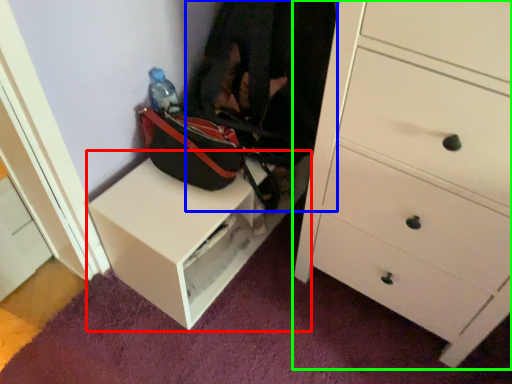
Question: Estimate the real-world distances between objects in this image. Which object is farther from table (highlighted by a red box), clothing (highlighted by a blue box) or chest of drawers (highlighted by a green box)?

Choices:
 (A) clothing
 (B) chest of drawers

Answer: (B)